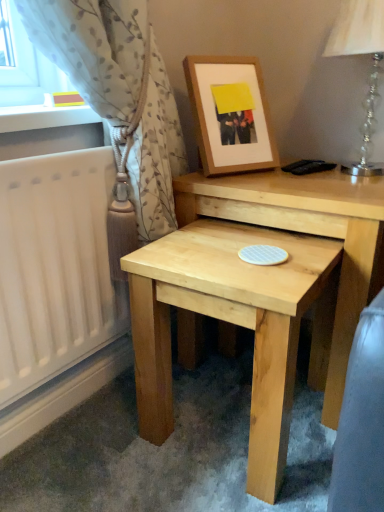
This screenshot has width=384, height=512. In order to click on vacant space to the left of clear crystal glass table lamp at upper right in this screenshot , I will do coord(279,183).